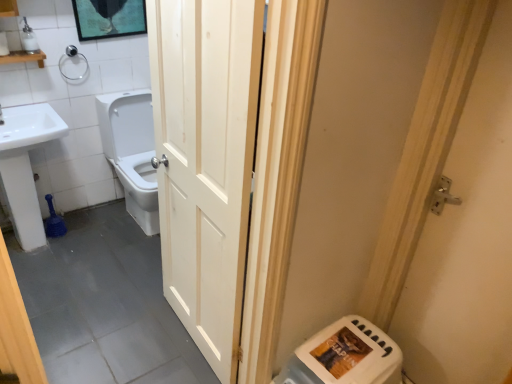
Question: Should I look upward or downward to see silver metallic door handle at right, which is the 1th door in right-to-left order?

Choices:
 (A) down
 (B) up

Answer: (A)

Question: Does white ceramic sink at left have a lesser width compared to white plastic water heater at lower right?

Choices:
 (A) yes
 (B) no

Answer: (A)

Question: Are white ceramic sink at left and white plastic water heater at lower right beside each other?

Choices:
 (A) yes
 (B) no

Answer: (B)

Question: Does white ceramic sink at left have a greater width compared to white plastic water heater at lower right?

Choices:
 (A) yes
 (B) no

Answer: (B)

Question: Is white ceramic sink at left bigger than white plastic water heater at lower right?

Choices:
 (A) yes
 (B) no

Answer: (A)

Question: Does white ceramic sink at left have a smaller size compared to white plastic water heater at lower right?

Choices:
 (A) yes
 (B) no

Answer: (B)

Question: Does white ceramic sink at left appear on the left side of white plastic water heater at lower right?

Choices:
 (A) no
 (B) yes

Answer: (B)

Question: Considering the relative sizes of white glossy toilet at center and white plastic soap dispenser at upper left in the image provided, is white glossy toilet at center taller than white plastic soap dispenser at upper left?

Choices:
 (A) no
 (B) yes

Answer: (B)

Question: Is white glossy toilet at center completely or partially outside of white plastic soap dispenser at upper left?

Choices:
 (A) yes
 (B) no

Answer: (A)

Question: Can you confirm if white glossy toilet at center is wider than white plastic soap dispenser at upper left?

Choices:
 (A) yes
 (B) no

Answer: (A)

Question: Considering the relative sizes of white glossy toilet at center and white plastic soap dispenser at upper left in the image provided, is white glossy toilet at center thinner than white plastic soap dispenser at upper left?

Choices:
 (A) no
 (B) yes

Answer: (A)

Question: Would you consider white glossy toilet at center to be distant from white plastic soap dispenser at upper left?

Choices:
 (A) yes
 (B) no

Answer: (B)

Question: From the image's perspective, does white glossy toilet at center appear higher than white plastic soap dispenser at upper left?

Choices:
 (A) yes
 (B) no

Answer: (B)

Question: Is silver metallic door handle at right, which is the 1th door in right-to-left order, a part of white wooden shelf at upper left?

Choices:
 (A) yes
 (B) no

Answer: (B)